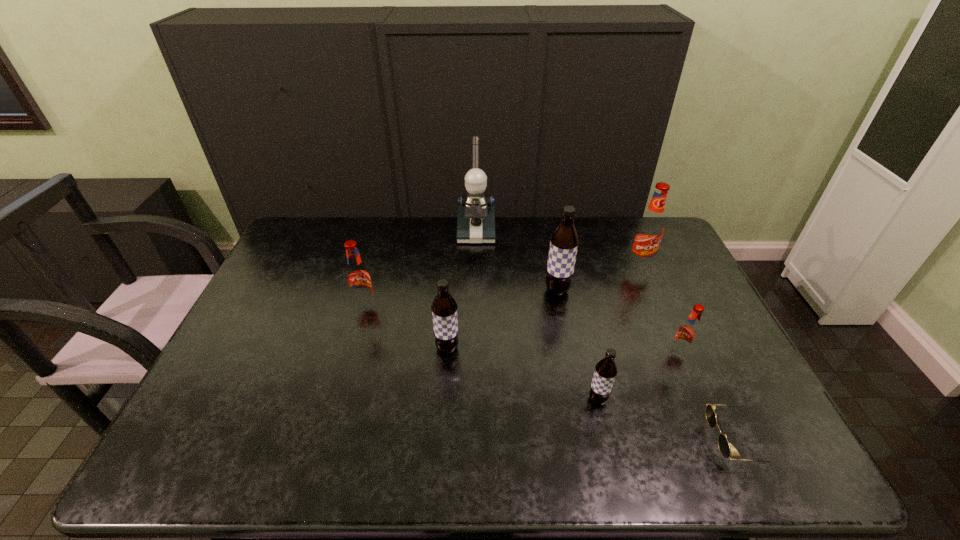
You are a GUI agent. You are given a task and a screenshot of the screen. Output one action in this format:
    pyautogui.click(x=<x>, y=<y>)
    Task: Click on the vacant region located on the left of the smallest brown root beer
    This screenshot has width=960, height=540.
    Given the screenshot: What is the action you would take?
    (x=469, y=399)

Find the location of a particular element. The image size is (960, 540). vacant point located on the front lenses of the nearest object is located at coordinates (552, 441).

The width and height of the screenshot is (960, 540). Identify the location of vacant region located 0.280m on the front lenses of the nearest object. (588, 441).

Find the location of a particular element. This screenshot has width=960, height=540. vacant area situated 0.370m on the front lenses of the nearest object is located at coordinates (548, 441).

Where is `object present at the far edge`? The width and height of the screenshot is (960, 540). object present at the far edge is located at coordinates (476, 216).

Locate an element on the screen. object that is at the near edge is located at coordinates [723, 444].

This screenshot has height=540, width=960. I want to click on sunglasses located at the right edge, so coord(723,444).

Identify the location of object that is at the near right corner. (723, 444).

You are a GUI agent. You are given a task and a screenshot of the screen. Output one action in this format:
    pyautogui.click(x=<x>, y=<y>)
    Task: Click on the free space at the far edge of the desktop
    
    Given the screenshot: What is the action you would take?
    pyautogui.click(x=516, y=240)

In the image, there is a desktop. Identify the location of vacant space at the near edge. (706, 448).